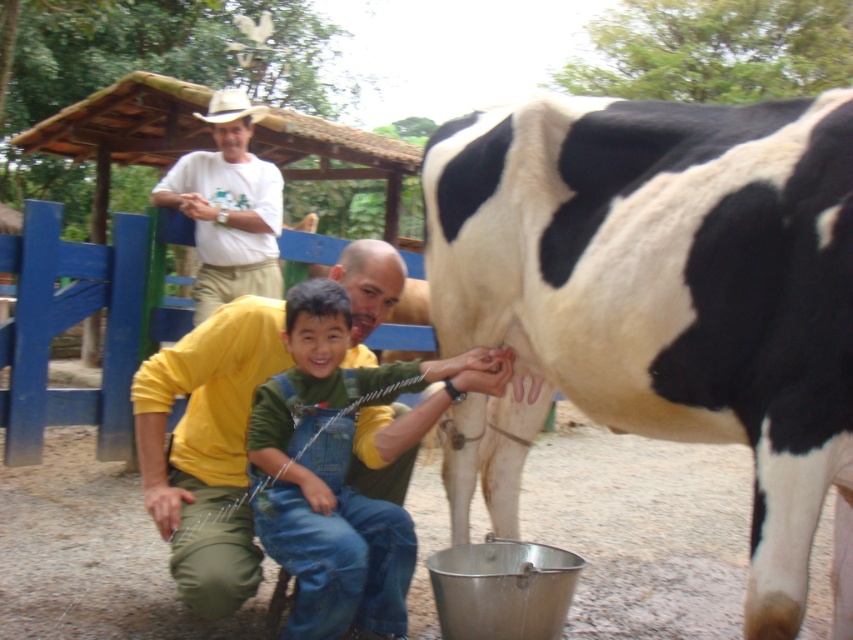
Question: Which point is closer to the camera taking this photo?

Choices:
 (A) (236, 576)
 (B) (747, 408)
 (C) (245, 225)

Answer: (B)

Question: Is yellow cotton shirt at center thinner than green denim overalls at center?

Choices:
 (A) no
 (B) yes

Answer: (A)

Question: Which object is positioned closest to the white cotton shirt at upper center?

Choices:
 (A) yellow cotton shirt at center
 (B) green denim overalls at center
 (C) black and white spotted cow at right

Answer: (A)

Question: Does green denim overalls at center appear over white cotton shirt at upper center?

Choices:
 (A) no
 (B) yes

Answer: (A)

Question: Is black and white spotted cow at right further to camera compared to green denim overalls at center?

Choices:
 (A) no
 (B) yes

Answer: (A)

Question: Which point appears closest to the camera in this image?

Choices:
 (A) (310, 444)
 (B) (848, 560)

Answer: (B)